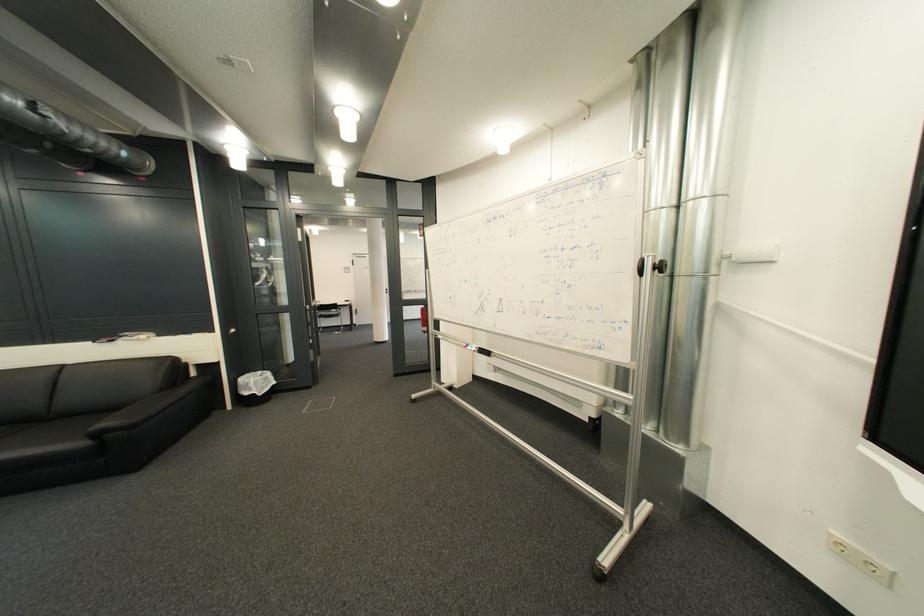
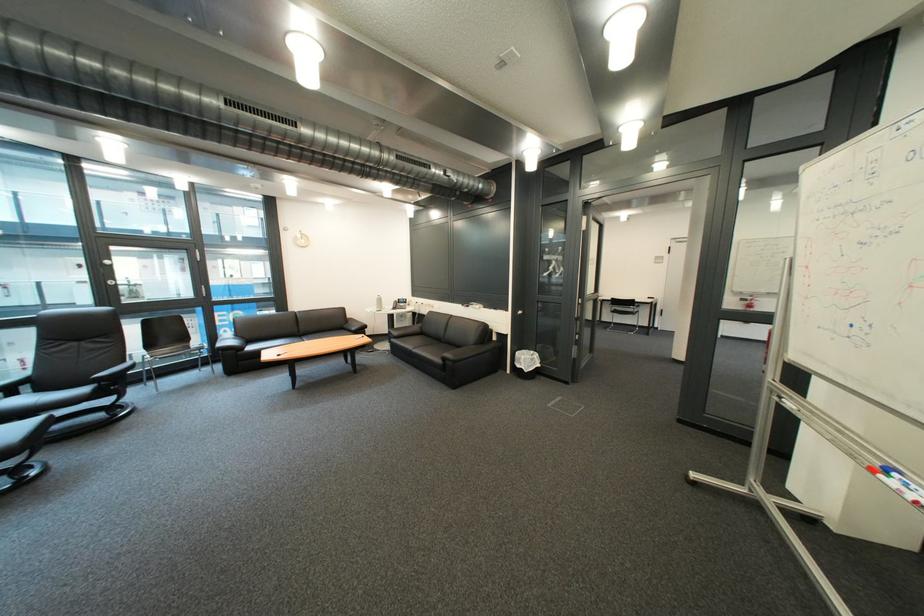
Locate, in the second image, the point that corresponds to (111,437) in the first image.

(457, 361)